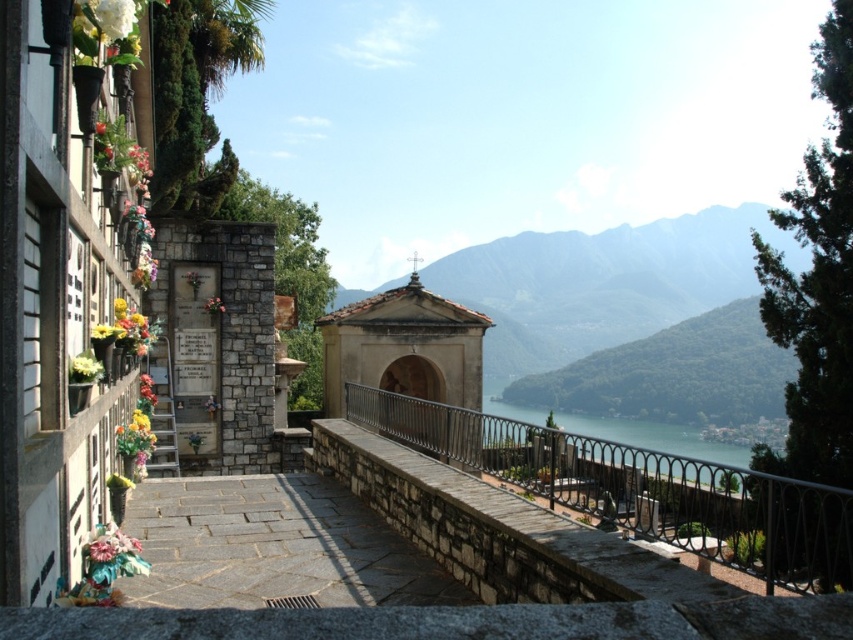
What are the coordinates of the green textured mountain at center?

The green textured mountain at center is located at coordinates point (602, 284).

You are standing at the viewpoint overlooking the scenic landscape. You notice the black wrought iron railing at center and the gray stone path at center. Which object is located below the other?

The black wrought iron railing at center is positioned under the gray stone path at center, so the railing is below the path.